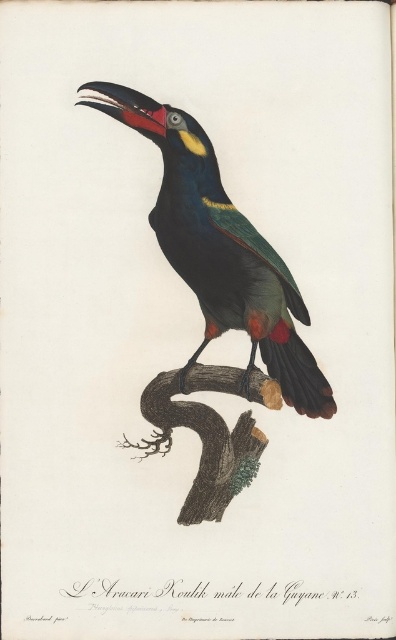
Question: Which object is closer to the camera taking this photo?

Choices:
 (A) brown textured branch at center
 (B) shiny black toucan at center

Answer: (B)

Question: Where is shiny black toucan at center located in relation to brown textured branch at center in the image?

Choices:
 (A) below
 (B) above

Answer: (B)

Question: Which point is farther to the camera?

Choices:
 (A) brown textured branch at center
 (B) shiny black toucan at center

Answer: (A)

Question: Does shiny black toucan at center have a greater width compared to brown textured branch at center?

Choices:
 (A) yes
 (B) no

Answer: (A)

Question: Is shiny black toucan at center to the right of brown textured branch at center from the viewer's perspective?

Choices:
 (A) yes
 (B) no

Answer: (A)